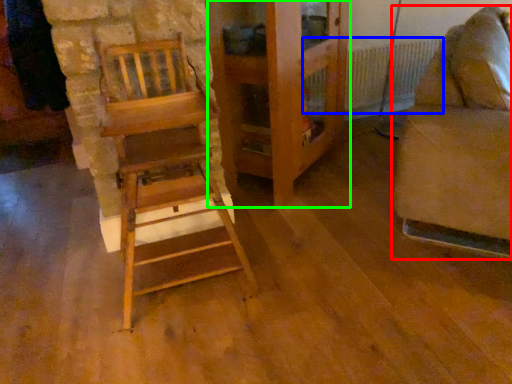
Question: Which object is positioned farthest from furniture (highlighted by a red box)? Select from radiator (highlighted by a blue box) and dresser (highlighted by a green box).

Choices:
 (A) radiator
 (B) dresser

Answer: (A)